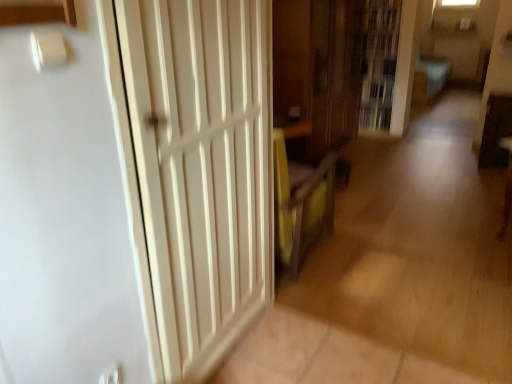
Locate an element on the screen. wooden bookcase at upper right is located at coordinates (379, 63).

What do you see at coordinates (202, 167) in the screenshot? I see `white wood door at left` at bounding box center [202, 167].

Image resolution: width=512 pixels, height=384 pixels. Identify the location of hardcover book at center, the first book viewed from the top. (378, 89).

Is hardcover book at center, the 1th book when ordered from bottom to top, inside the boundaries of hardcover book at center, marked as the 2th book in a bottom-to-top arrangement, or outside?

hardcover book at center, the 1th book when ordered from bottom to top, is spatially situated outside hardcover book at center, marked as the 2th book in a bottom-to-top arrangement.

Relative to hardcover book at center, the first book viewed from the top, is hardcover book at center, the 1th book when ordered from bottom to top, in front or behind?

hardcover book at center, the 1th book when ordered from bottom to top, is positioned farther from the viewer than hardcover book at center, the first book viewed from the top.

Which of these two, hardcover book at center, the 2th book positioned from the top, or hardcover book at center, marked as the 2th book in a bottom-to-top arrangement, is smaller?

Smaller between the two is hardcover book at center, marked as the 2th book in a bottom-to-top arrangement.

From the image's perspective, between hardcover book at center, the first book viewed from the top, and wooden bookcase at upper right, which one is located above?

wooden bookcase at upper right.

How different are the orientations of hardcover book at center, marked as the 2th book in a bottom-to-top arrangement, and wooden bookcase at upper right in degrees?

There is a 0.14-degree angle between the facing directions of hardcover book at center, marked as the 2th book in a bottom-to-top arrangement, and wooden bookcase at upper right.

Considering the relative sizes of hardcover book at center, marked as the 2th book in a bottom-to-top arrangement, and wooden bookcase at upper right in the image provided, is hardcover book at center, marked as the 2th book in a bottom-to-top arrangement, wider than wooden bookcase at upper right?

Indeed, hardcover book at center, marked as the 2th book in a bottom-to-top arrangement, has a greater width compared to wooden bookcase at upper right.

Could you tell me if hardcover book at center, marked as the 2th book in a bottom-to-top arrangement, is turned towards wooden bookcase at upper right?

Yes, hardcover book at center, marked as the 2th book in a bottom-to-top arrangement, is turned towards wooden bookcase at upper right.

Is wooden bookcase at upper right bigger or smaller than hardcover book at center, the 2th book positioned from the top?

In the image, wooden bookcase at upper right appears to be larger than hardcover book at center, the 2th book positioned from the top.

Considering the relative sizes of wooden bookcase at upper right and hardcover book at center, the 1th book when ordered from bottom to top, in the image provided, is wooden bookcase at upper right taller than hardcover book at center, the 1th book when ordered from bottom to top,?

Yes.

From a real-world perspective, between wooden bookcase at upper right and hardcover book at center, the 1th book when ordered from bottom to top, who is vertically higher?

From a 3D spatial view, wooden bookcase at upper right is above.

How different are the orientations of wooden bookcase at upper right and hardcover book at center, the 2th book positioned from the top, in degrees?

3.8 degrees.

Is wooden cabinet at center a part of hardcover book at center, the 1th book when ordered from bottom to top?

Actually, wooden cabinet at center is outside hardcover book at center, the 1th book when ordered from bottom to top.

Is hardcover book at center, the 2th book positioned from the top, bigger or smaller than wooden cabinet at center?

hardcover book at center, the 2th book positioned from the top, is smaller than wooden cabinet at center.

Considering the relative sizes of hardcover book at center, the 2th book positioned from the top, and wooden cabinet at center in the image provided, is hardcover book at center, the 2th book positioned from the top, thinner than wooden cabinet at center?

Indeed, hardcover book at center, the 2th book positioned from the top, has a lesser width compared to wooden cabinet at center.

Is white wood door at left bigger than wooden cabinet at center?

Actually, white wood door at left might be smaller than wooden cabinet at center.

Is white wood door at left looking in the opposite direction of wooden cabinet at center?

No, white wood door at left's orientation is not away from wooden cabinet at center.

Is white wood door at left not within wooden cabinet at center?

Yes, white wood door at left is outside of wooden cabinet at center.

From the image's perspective, is white wood door at left beneath wooden cabinet at center?

Indeed, from the image's perspective, white wood door at left is shown beneath wooden cabinet at center.

Is the position of wooden cabinet at center less distant than that of white wood door at left?

No.

Is wooden cabinet at center at the right side of white wood door at left?

Indeed, wooden cabinet at center is positioned on the right side of white wood door at left.

Based on the photo, would you say wooden cabinet at center is a long distance from white wood door at left?

Yes.

From the image's perspective, is wooden cabinet at center on top of white wood door at left?

Indeed, from the image's perspective, wooden cabinet at center is shown above white wood door at left.

Looking at this image, considering the sizes of wooden cabinet at center and wooden bookcase at upper right in the image, is wooden cabinet at center taller or shorter than wooden bookcase at upper right?

Clearly, wooden cabinet at center is taller compared to wooden bookcase at upper right.

Based on their sizes in the image, would you say wooden cabinet at center is bigger or smaller than wooden bookcase at upper right?

Considering their sizes, wooden cabinet at center takes up more space than wooden bookcase at upper right.

Could wooden bookcase at upper right be considered to be inside wooden cabinet at center?

No, wooden bookcase at upper right is located outside of wooden cabinet at center.

Based on the photo, considering their positions, is wooden cabinet at center located in front of or behind wooden bookcase at upper right?

Visually, wooden cabinet at center is located in front of wooden bookcase at upper right.

Where is `book above the hardcover book at center, the 1th book when ordered from bottom to top (from a real-world perspective)`? book above the hardcover book at center, the 1th book when ordered from bottom to top (from a real-world perspective) is located at coordinates (378, 89).

From a real-world perspective, count 1st books downward from the wooden bookcase at upper right and point to it. Please provide its 2D coordinates.

[(378, 89)]

Estimate the real-world distances between objects in this image. Which object is further from wooden cabinet at center, hardcover book at center, marked as the 2th book in a bottom-to-top arrangement, or hardcover book at center, the 1th book when ordered from bottom to top?

hardcover book at center, the 1th book when ordered from bottom to top, is positioned further to the anchor wooden cabinet at center.

When comparing their distances from hardcover book at center, the 2th book positioned from the top, does wooden cabinet at center or white wood door at left seem further?

Among the two, white wood door at left is located further to hardcover book at center, the 2th book positioned from the top.

Looking at the image, which one is located closer to hardcover book at center, marked as the 2th book in a bottom-to-top arrangement, wooden cabinet at center or wooden bookcase at upper right?

The object closer to hardcover book at center, marked as the 2th book in a bottom-to-top arrangement, is wooden bookcase at upper right.

Looking at the image, which one is located further to wooden bookcase at upper right, hardcover book at center, the first book viewed from the top, or white wood door at left?

Based on the image, white wood door at left appears to be further to wooden bookcase at upper right.

From the image, which object appears to be nearer to hardcover book at center, the 1th book when ordered from bottom to top, wooden cabinet at center or hardcover book at center, marked as the 2th book in a bottom-to-top arrangement?

The object closer to hardcover book at center, the 1th book when ordered from bottom to top, is hardcover book at center, marked as the 2th book in a bottom-to-top arrangement.

When comparing their distances from white wood door at left, does hardcover book at center, the 2th book positioned from the top, or hardcover book at center, the first book viewed from the top, seem closer?

hardcover book at center, the first book viewed from the top.

Looking at the image, which one is located further to wooden bookcase at upper right, wooden cabinet at center or hardcover book at center, the 1th book when ordered from bottom to top?

wooden cabinet at center is positioned further to the anchor wooden bookcase at upper right.

Estimate the real-world distances between objects in this image. Which object is further from hardcover book at center, the 1th book when ordered from bottom to top, white wood door at left or wooden cabinet at center?

white wood door at left lies further to hardcover book at center, the 1th book when ordered from bottom to top, than the other object.

Find the location of a particular element. Image resolution: width=512 pixels, height=384 pixels. cabinetry located between white wood door at left and wooden bookcase at upper right in the depth direction is located at coordinates (318, 69).

Locate an element on the screen. Image resolution: width=512 pixels, height=384 pixels. bookcase between white wood door at left and hardcover book at center, the first book viewed from the top, from front to back is located at coordinates (379, 63).

Locate an element on the screen. This screenshot has height=384, width=512. book positioned between white wood door at left and hardcover book at center, the 2th book positioned from the top, from near to far is located at coordinates (378, 89).

Locate an element on the screen. The height and width of the screenshot is (384, 512). book between wooden cabinet at center and hardcover book at center, the 2th book positioned from the top, along the z-axis is located at coordinates (378, 89).